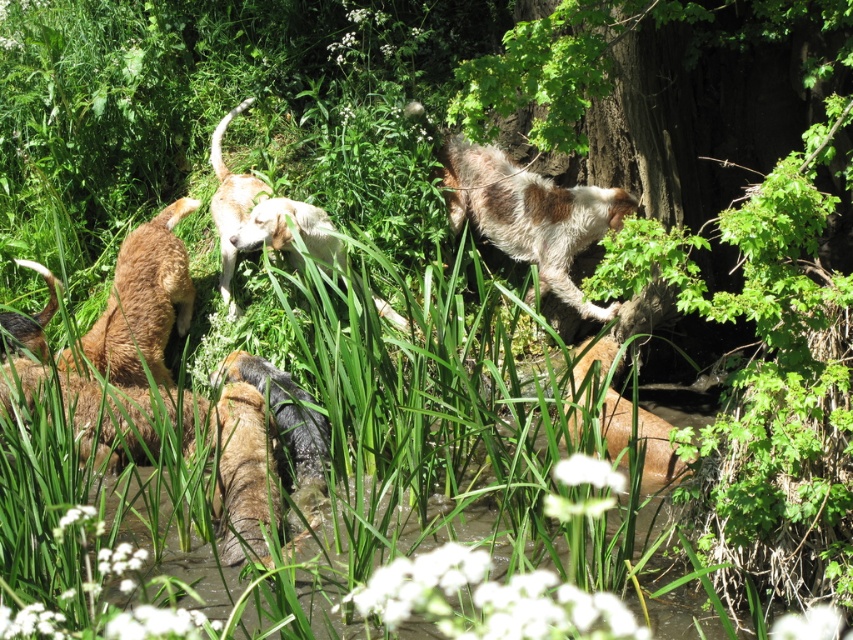
Looking at this image, is brown furry dog at lower right to the left of white fur dog at center from the viewer's perspective?

Incorrect, brown furry dog at lower right is not on the left side of white fur dog at center.

Who is lower down, brown furry dog at lower right or white fur dog at center?

brown furry dog at lower right

Between point (618, 436) and point (244, 227), which one is positioned in front?

Point (618, 436) is more forward.

Where is `brown furry dog at lower right`? This screenshot has width=853, height=640. brown furry dog at lower right is located at coordinates (640, 436).

Does brown fur dog at center have a smaller size compared to brown furry dog at lower right?

Incorrect, brown fur dog at center is not smaller in size than brown furry dog at lower right.

Does brown fur dog at center have a greater height compared to brown furry dog at lower right?

Indeed, brown fur dog at center has a greater height compared to brown furry dog at lower right.

Find the location of a particular element. brown fur dog at center is located at coordinates (264, 451).

Is point (550, 180) positioned before point (619, 412)?

No.

Between brown fur dog at upper center and brown furry dog at lower right, which one is positioned lower?

brown furry dog at lower right

Does point (547, 220) lie behind point (577, 349)?

No.

The width and height of the screenshot is (853, 640). I want to click on brown fur dog at upper center, so click(531, 214).